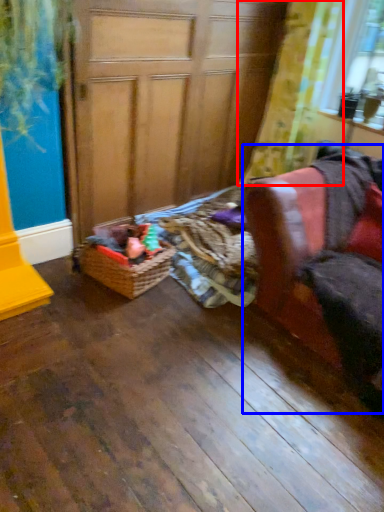
Question: Which of the following is the farthest to the observer, curtain (highlighted by a red box) or armchair (highlighted by a blue box)?

Choices:
 (A) curtain
 (B) armchair

Answer: (A)